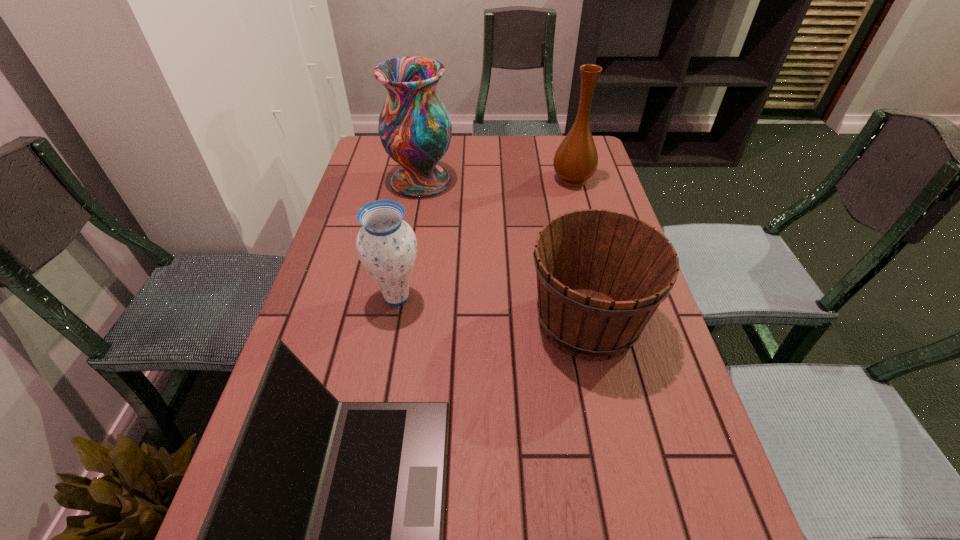
The image size is (960, 540). In order to click on vacant position at the far edge of the desktop in this screenshot , I will do (486, 165).

In order to click on vacant space at the right edge of the desktop in this screenshot , I will do `click(620, 447)`.

Find the location of a particular element. vacant point located between the rightmost vase and the nearest vase is located at coordinates (485, 238).

Locate an element on the screen. object that stands as the closest to the rightmost vase is located at coordinates (415, 129).

Select which object is the closest to the rightmost vase. Please provide its 2D coordinates. Your answer should be formatted as a tuple, i.e. [(x, y)], where the tuple contains the x and y coordinates of a point satisfying the conditions above.

[(415, 129)]

Locate which vase is the closest to the nearest vase. Please provide its 2D coordinates. Your answer should be formatted as a tuple, i.e. [(x, y)], where the tuple contains the x and y coordinates of a point satisfying the conditions above.

[(415, 129)]

Select which vase appears as the third closest to the wine bucket. Please provide its 2D coordinates. Your answer should be formatted as a tuple, i.e. [(x, y)], where the tuple contains the x and y coordinates of a point satisfying the conditions above.

[(415, 129)]